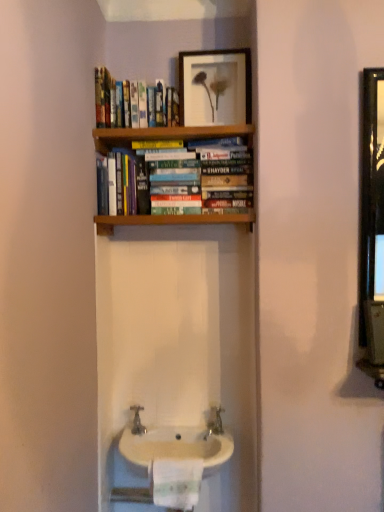
Locate an element on the screen. The width and height of the screenshot is (384, 512). free space to the right of silver metallic tap at center is located at coordinates (185, 428).